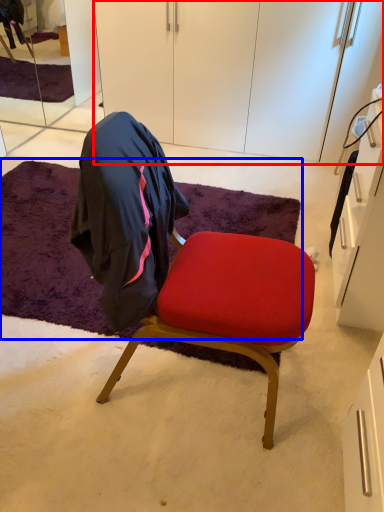
Question: Which point is closer to the camera, cabinetry (highlighted by a red box) or mat (highlighted by a blue box)?

Choices:
 (A) cabinetry
 (B) mat

Answer: (B)